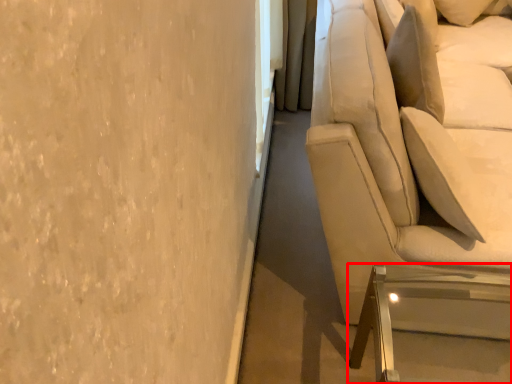
Question: From the image's perspective, what is the correct spatial relationship of furniture (annotated by the red box) in relation to studio couch?

Choices:
 (A) above
 (B) below

Answer: (B)